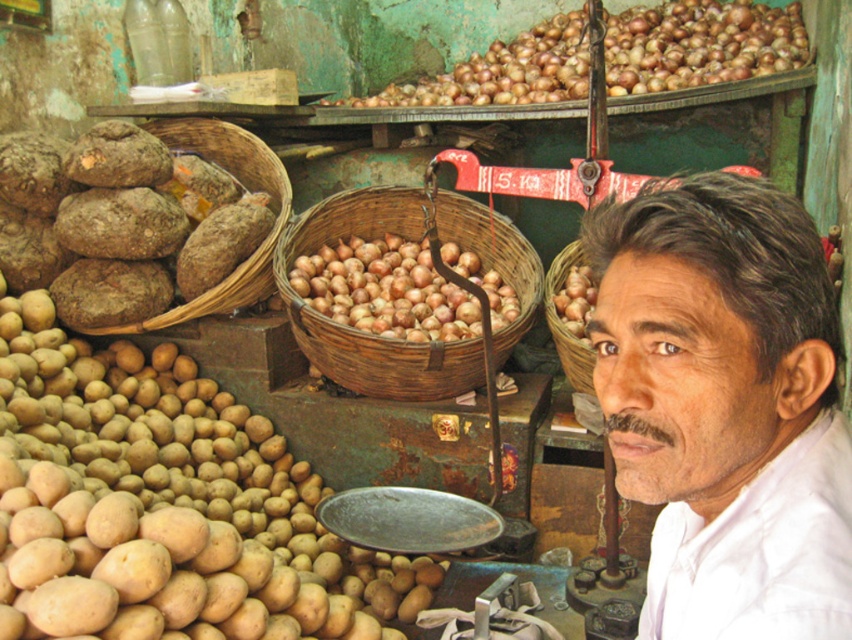
This screenshot has width=852, height=640. Describe the element at coordinates (697, 44) in the screenshot. I see `brown matte onions at upper center` at that location.

Can you confirm if brown matte onions at upper center is positioned to the right of natural brown woven basket at center?

Yes, brown matte onions at upper center is to the right of natural brown woven basket at center.

Locate an element on the screen. The image size is (852, 640). brown matte onions at upper center is located at coordinates (697, 44).

This screenshot has width=852, height=640. Find the location of `brown matte onions at upper center`. brown matte onions at upper center is located at coordinates (697, 44).

Does point (799, 236) come closer to viewer compared to point (614, 33)?

Yes, it is.

What are the coordinates of `white matte shirt at upper right` in the screenshot? It's located at (724, 406).

The width and height of the screenshot is (852, 640). In order to click on white matte shirt at upper right in this screenshot , I will do `click(724, 406)`.

Between point (275, 198) and point (556, 317), which one is positioned behind?

The point (275, 198) is more distant.

Does brown woven basket at left appear on the right side of natural brown woven basket at center?

Incorrect, brown woven basket at left is not on the right side of natural brown woven basket at center.

Does point (171, 320) come behind point (576, 385)?

Yes, point (171, 320) is farther from viewer.

This screenshot has width=852, height=640. In order to click on brown woven basket at left in this screenshot , I will do `click(246, 188)`.